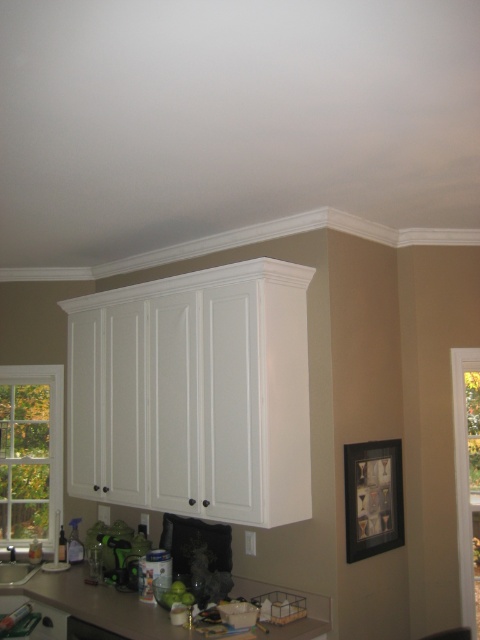
Question: Which of the following is the farthest from the observer?

Choices:
 (A) black matte dishwasher at lower center
 (B) matte brown countertop at lower center
 (C) white glossy sink at lower center

Answer: (C)

Question: Is white glossy sink at lower center to the left of black matte dishwasher at lower center from the viewer's perspective?

Choices:
 (A) yes
 (B) no

Answer: (A)

Question: Which object appears closest to the camera in this image?

Choices:
 (A) clear glass window at upper left
 (B) black matte dishwasher at lower center
 (C) clear glass window at left
 (D) white glossy sink at lower center

Answer: (B)

Question: Is clear glass window at left to the left of black matte dishwasher at lower center from the viewer's perspective?

Choices:
 (A) no
 (B) yes

Answer: (B)

Question: Can you confirm if clear glass window at left is bigger than matte brown countertop at lower center?

Choices:
 (A) yes
 (B) no

Answer: (B)

Question: Which object appears closest to the camera in this image?

Choices:
 (A) white glossy sink at lower center
 (B) black matte dishwasher at lower center

Answer: (B)